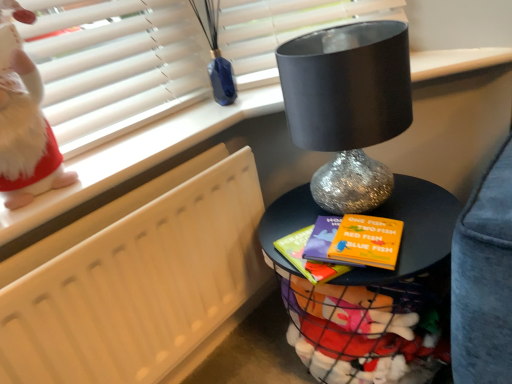
What do you see at coordinates (27, 138) in the screenshot?
I see `white fluffy doll at upper left` at bounding box center [27, 138].

Measure the distance between shiny metallic lamp at center and camera.

shiny metallic lamp at center and camera are 27.52 inches apart from each other.

Image resolution: width=512 pixels, height=384 pixels. Identify the location of shiny metallic lamp at center. (348, 106).

Locate an element on the screen. white fluffy doll at upper left is located at coordinates (27, 138).

The image size is (512, 384). What are the coordinates of `table lamp that appears above the white matte radiator at left (from the image's perspective)` in the screenshot? It's located at (348, 106).

Which of these two, white matte radiator at left or shiny metallic lamp at center, stands shorter?

shiny metallic lamp at center.

Is the position of white matte radiator at left less distant than that of shiny metallic lamp at center?

Yes.

Is point (24, 359) behind point (324, 202)?

No, it is not.

From the image's perspective, which object appears higher, shiny metallic table at center or shiny metallic lamp at center?

shiny metallic lamp at center is shown above in the image.

Is shiny metallic table at center directly adjacent to shiny metallic lamp at center?

No, shiny metallic table at center is not next to shiny metallic lamp at center.

In the scene shown: From a real-world perspective, is shiny metallic table at center above or below shiny metallic lamp at center?

shiny metallic table at center is situated lower than shiny metallic lamp at center in the real world.

Which is more to the left, shiny metallic table at center or shiny metallic lamp at center?

shiny metallic lamp at center.

Is white matte radiator at left completely or partially outside of white fluffy doll at upper left?

Yes, white matte radiator at left is not within white fluffy doll at upper left.

Is white matte radiator at left at the left side of white fluffy doll at upper left?

Incorrect, white matte radiator at left is not on the left side of white fluffy doll at upper left.

From the image's perspective, is white matte radiator at left beneath white fluffy doll at upper left?

Indeed, from the image's perspective, white matte radiator at left is shown beneath white fluffy doll at upper left.

Which object is more forward, shiny metallic lamp at center or shiny metallic table at center?

shiny metallic table at center is more forward.

From a real-world perspective, is shiny metallic lamp at center over shiny metallic table at center?

Yes, from a real-world perspective, shiny metallic lamp at center is over shiny metallic table at center

From the image's perspective, is shiny metallic lamp at center over shiny metallic table at center?

Yes, from the image's perspective, shiny metallic lamp at center is above shiny metallic table at center.

This screenshot has height=384, width=512. In the image, there is a white fluffy doll at upper left. In order to click on table lamp below it (from a real-world perspective) in this screenshot , I will do `click(348, 106)`.

Which is behind, point (361, 61) or point (10, 194)?

Positioned behind is point (10, 194).

From the image's perspective, which one is positioned higher, shiny metallic lamp at center or white fluffy doll at upper left?

white fluffy doll at upper left, from the image's perspective.

From the picture: Which object is further away from the camera, shiny metallic lamp at center or white fluffy doll at upper left?

shiny metallic lamp at center is further away from the camera.

Does white fluffy doll at upper left have a smaller size compared to white matte radiator at left?

Yes, white fluffy doll at upper left is smaller than white matte radiator at left.

Is white fluffy doll at upper left oriented away from white matte radiator at left?

No, white fluffy doll at upper left's orientation is not away from white matte radiator at left.

Is white fluffy doll at upper left closer to camera compared to white matte radiator at left?

Yes, white fluffy doll at upper left is in front of white matte radiator at left.

Does white fluffy doll at upper left appear on the right side of shiny metallic lamp at center?

In fact, white fluffy doll at upper left is to the left of shiny metallic lamp at center.

Between white fluffy doll at upper left and shiny metallic lamp at center, which one is positioned in front?

white fluffy doll at upper left is in front.

Considering the sizes of white fluffy doll at upper left and shiny metallic lamp at center in the image, is white fluffy doll at upper left wider or thinner than shiny metallic lamp at center?

Considering their sizes, white fluffy doll at upper left looks slimmer than shiny metallic lamp at center.

From a real-world perspective, is white fluffy doll at upper left under shiny metallic lamp at center?

No.

The height and width of the screenshot is (384, 512). In order to click on radiator that appears below the shiny metallic lamp at center (from a real-world perspective) in this screenshot , I will do [136, 280].

Where is `furniture that is below the shiny metallic lamp at center (from the image's perspective)`? This screenshot has height=384, width=512. furniture that is below the shiny metallic lamp at center (from the image's perspective) is located at coordinates (364, 288).

From the image, which object appears to be nearer to shiny metallic lamp at center, white matte radiator at left or shiny metallic table at center?

shiny metallic table at center.

Based on their spatial positions, is shiny metallic table at center or white matte radiator at left closer to white fluffy doll at upper left?

white matte radiator at left.

Looking at the image, which one is located further to white matte radiator at left, white fluffy doll at upper left or shiny metallic lamp at center?

shiny metallic lamp at center lies further to white matte radiator at left than the other object.

Looking at the image, which one is located further to shiny metallic table at center, white fluffy doll at upper left or white matte radiator at left?

The object further to shiny metallic table at center is white fluffy doll at upper left.

Consider the image. Considering their positions, is white fluffy doll at upper left positioned closer to shiny metallic lamp at center than shiny metallic table at center?

shiny metallic table at center is closer to shiny metallic lamp at center.

Based on their spatial positions, is white fluffy doll at upper left or shiny metallic table at center closer to white matte radiator at left?

white fluffy doll at upper left is closer to white matte radiator at left.

Estimate the real-world distances between objects in this image. Which object is closer to shiny metallic table at center, white fluffy doll at upper left or shiny metallic lamp at center?

shiny metallic lamp at center is closer to shiny metallic table at center.

From the image, which object appears to be nearer to shiny metallic lamp at center, shiny metallic table at center or white matte radiator at left?

shiny metallic table at center.

At what (x,y) coordinates should I click in order to perform the action: click on radiator between white fluffy doll at upper left and shiny metallic table at center in the horizontal direction. Please return your answer as a coordinate pair (x, y). This screenshot has width=512, height=384. Looking at the image, I should click on (136, 280).

Where is `table lamp located between white matte radiator at left and shiny metallic table at center in the left-right direction`? The width and height of the screenshot is (512, 384). table lamp located between white matte radiator at left and shiny metallic table at center in the left-right direction is located at coordinates (348, 106).

Where is `table lamp between white fluffy doll at upper left and shiny metallic table at center`? This screenshot has width=512, height=384. table lamp between white fluffy doll at upper left and shiny metallic table at center is located at coordinates (348, 106).

You are a GUI agent. You are given a task and a screenshot of the screen. Output one action in this format:
    pyautogui.click(x=<x>, y=<y>)
    Task: Click on the radiator between white fluffy doll at upper left and shiny metallic lamp at center from left to right
    This screenshot has height=384, width=512.
    Given the screenshot: What is the action you would take?
    pyautogui.click(x=136, y=280)